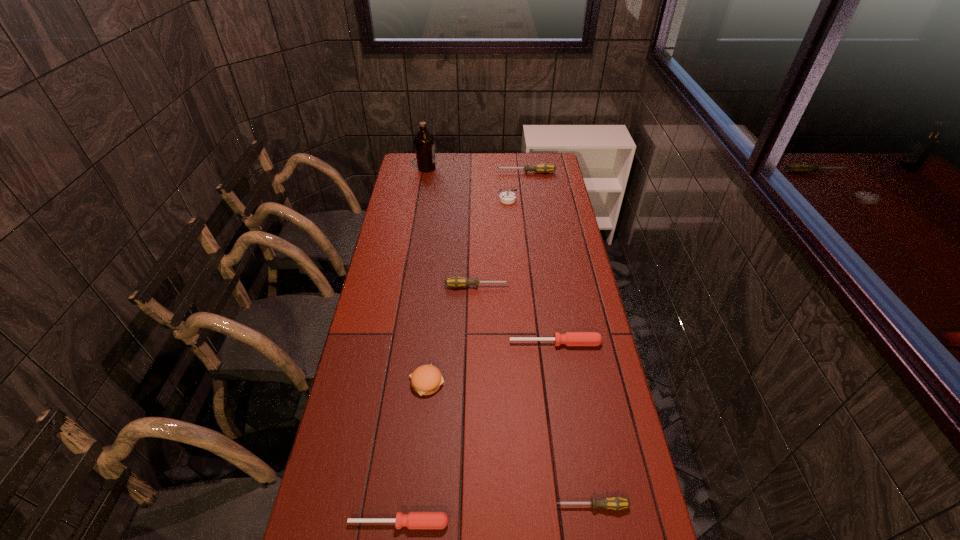
Choose which red screwdriver is the second nearest neighbor to the farthest screwdriver. Please provide its 2D coordinates. Your answer should be formatted as a tuple, i.e. [(x, y)], where the tuple contains the x and y coordinates of a point satisfying the conditions above.

[(414, 520)]

Identify the location of red screwdriver identified as the second closest to the farthest gray screwdriver. The width and height of the screenshot is (960, 540). (414, 520).

Locate an element on the screen. free space in the image that satisfies the following two spatial constraints: 1. on the label of the brown olive oil; 2. on the right side of the farther red screwdriver is located at coordinates (397, 343).

Locate an element on the screen. Image resolution: width=960 pixels, height=540 pixels. blank area in the image that satisfies the following two spatial constraints: 1. on the label of the olive oil; 2. on the left side of the nearest object is located at coordinates (368, 523).

Locate an element on the screen. free spot that satisfies the following two spatial constraints: 1. on the label of the olive oil; 2. on the left side of the nearest screwdriver is located at coordinates (368, 523).

Find the location of a particular element. This screenshot has width=960, height=540. vacant space that satisfies the following two spatial constraints: 1. at the tip of the biggest gray screwdriver; 2. on the right side of the third farthest screwdriver is located at coordinates (549, 343).